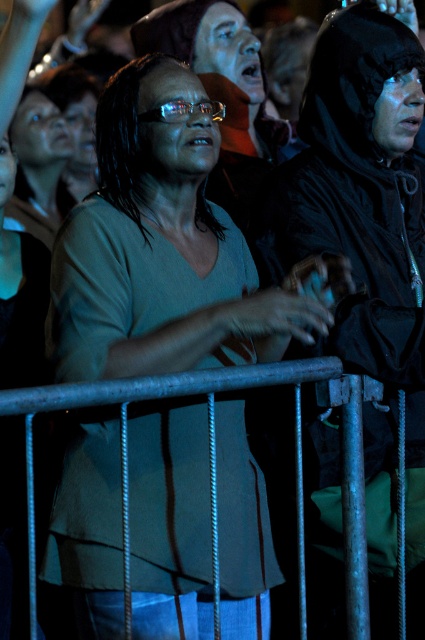
Does matte green shirt at center have a smaller size compared to metallic gray rail at center?

Incorrect, matte green shirt at center is not smaller in size than metallic gray rail at center.

Which is above, matte green shirt at center or metallic gray rail at center?

matte green shirt at center is higher up.

This screenshot has height=640, width=425. What do you see at coordinates (161, 248) in the screenshot?
I see `matte green shirt at center` at bounding box center [161, 248].

The height and width of the screenshot is (640, 425). Find the location of `matte green shirt at center`. matte green shirt at center is located at coordinates (161, 248).